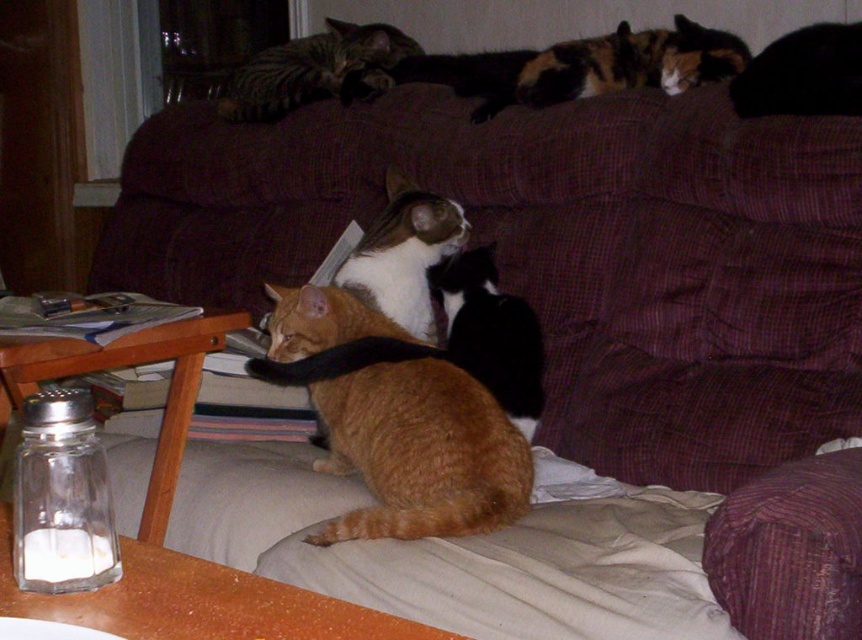
You are a cat owner trying to fit a new cat bed into the space between the black fur cat at upper right and the black fur cat at center. The cat bed is 20 cm wide. Can the cat bed fit in the space between them?

The black fur cat at upper right has a lesser width compared to black fur cat at center. Since the cat bed is 20 cm wide, it depends on the actual distance between them. However, the description only mentions their widths, not the space between them. Therefore, we cannot determine if the cat bed will fit based on the provided information.

You are a cat owner who wants to place a small toy between the orange fur cat at center and the black and white fur at center. What is the minimum distance the toy needs to be placed from each cat to ensure it is between them?

The minimum distance the toy needs to be placed from each cat is 5.28 inches, which is half of the 10.56 inches distance between the orange fur cat at center and the black and white fur at center.